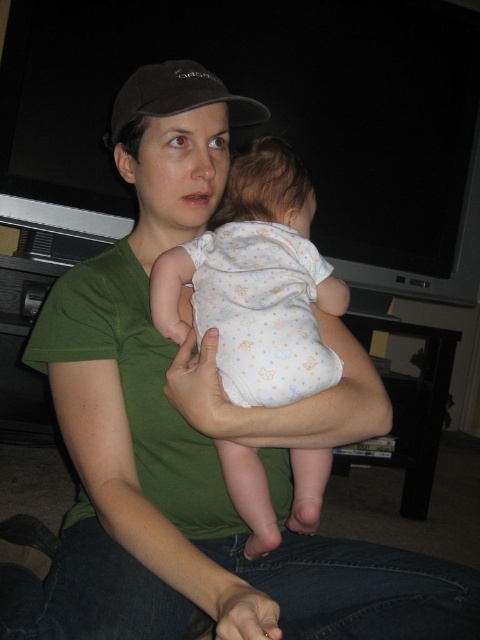
Question: Among these points, which one is nearest to the camera?

Choices:
 (A) (327, 476)
 (B) (213, 83)

Answer: (B)

Question: Considering the relative positions of white dotted fabric at center and black fabric baseball cap at upper center in the image provided, where is white dotted fabric at center located with respect to black fabric baseball cap at upper center?

Choices:
 (A) below
 (B) above

Answer: (A)

Question: Which point is farther to the camera?

Choices:
 (A) (243, 195)
 (B) (222, 83)

Answer: (A)

Question: Does white dotted fabric at center appear on the left side of black fabric baseball cap at upper center?

Choices:
 (A) yes
 (B) no

Answer: (B)

Question: Does white dotted fabric at center appear under black fabric baseball cap at upper center?

Choices:
 (A) yes
 (B) no

Answer: (A)

Question: Which object appears farthest from the camera in this image?

Choices:
 (A) black fabric baseball cap at upper center
 (B) white dotted fabric at center

Answer: (A)